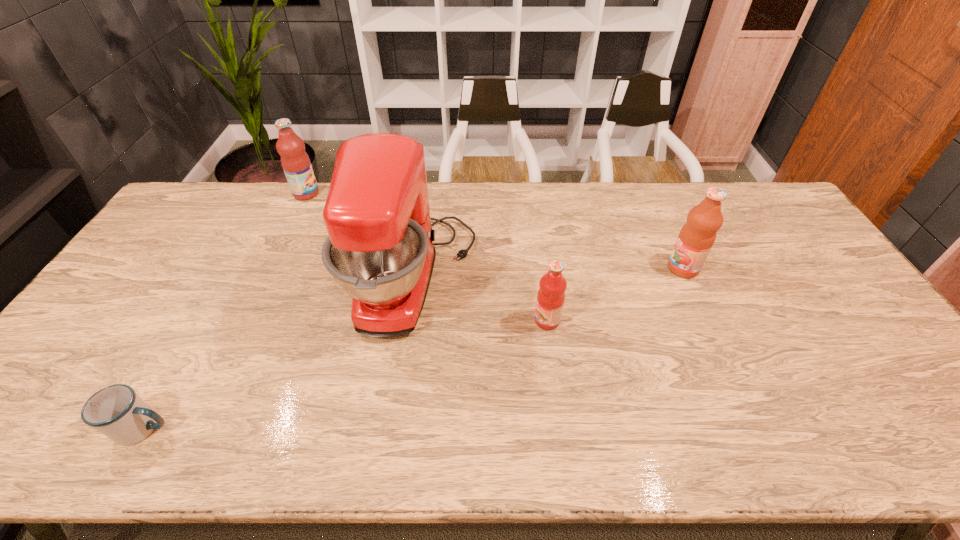
Where is `unoccupied area between the mug and the tallest object`? The height and width of the screenshot is (540, 960). unoccupied area between the mug and the tallest object is located at coordinates (279, 354).

Image resolution: width=960 pixels, height=540 pixels. In order to click on free spot between the second shortest object and the rightmost object in this screenshot , I will do `click(615, 294)`.

Image resolution: width=960 pixels, height=540 pixels. I want to click on free space between the kitchen mixer and the second shortest object, so click(x=481, y=300).

Where is `object that is the nearest to the kitchen mixer`? This screenshot has height=540, width=960. object that is the nearest to the kitchen mixer is located at coordinates (551, 295).

You are a GUI agent. You are given a task and a screenshot of the screen. Output one action in this format:
    pyautogui.click(x=<x>, y=<y>)
    Task: Click on the object that is the closest to the nearest object
    Image resolution: width=960 pixels, height=540 pixels.
    Given the screenshot: What is the action you would take?
    pyautogui.click(x=380, y=250)

Identify which fruit juice is located as the nearest to the farthest fruit juice. Please provide its 2D coordinates. Your answer should be formatted as a tuple, i.e. [(x, y)], where the tuple contains the x and y coordinates of a point satisfying the conditions above.

[(551, 295)]

Locate an element on the screen. fruit juice that stands as the second closest to the rightmost fruit juice is located at coordinates (295, 162).